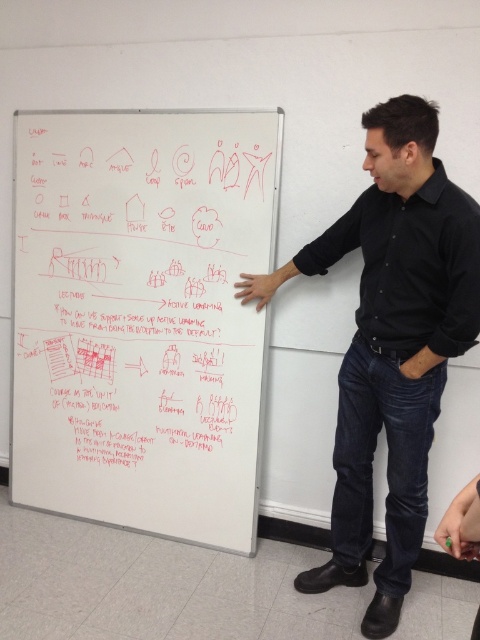
What is the relationship between the size of the whiteboard at center and the black shirt at center?

The whiteboard at center has a larger size compared to the black shirt at center.

You are standing in the classroom and see the point marked at coordinates (109, 208) on the whiteboard. If you want to touch that point with a ruler that is 2 meters long, can you reach it?

The distance of point (109, 208) from viewer is 2.51 meters. Since the ruler is only 2 meters long, you cannot reach the point with it.

You are a student trying to take a photo of the whiteboard at center and the black shirt at center during a lecture. Which object should you focus on first if you want to capture both in the frame without moving the camera?

The whiteboard at center is wider than the black shirt at center, so you should focus on the whiteboard at center first to ensure it fits in the frame, then adjust to include the black shirt at center.